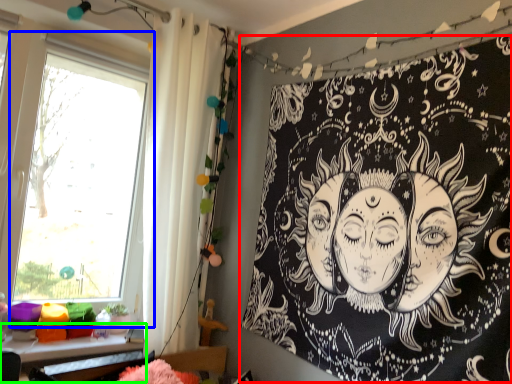
Question: Which object is positioned closest to bulletin board (highlighted by a red box)? Select from window (highlighted by a blue box) and table (highlighted by a green box).

Choices:
 (A) window
 (B) table

Answer: (B)